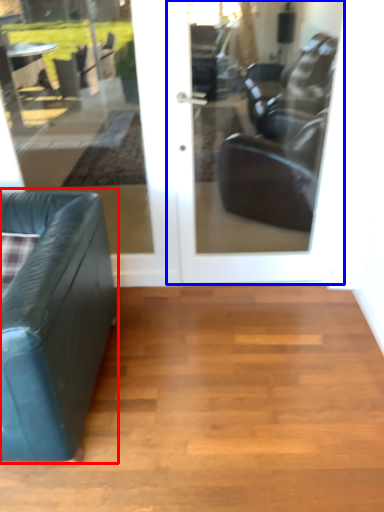
Question: Which point is further to the camera, studio couch (highlighted by a red box) or door (highlighted by a blue box)?

Choices:
 (A) studio couch
 (B) door

Answer: (B)